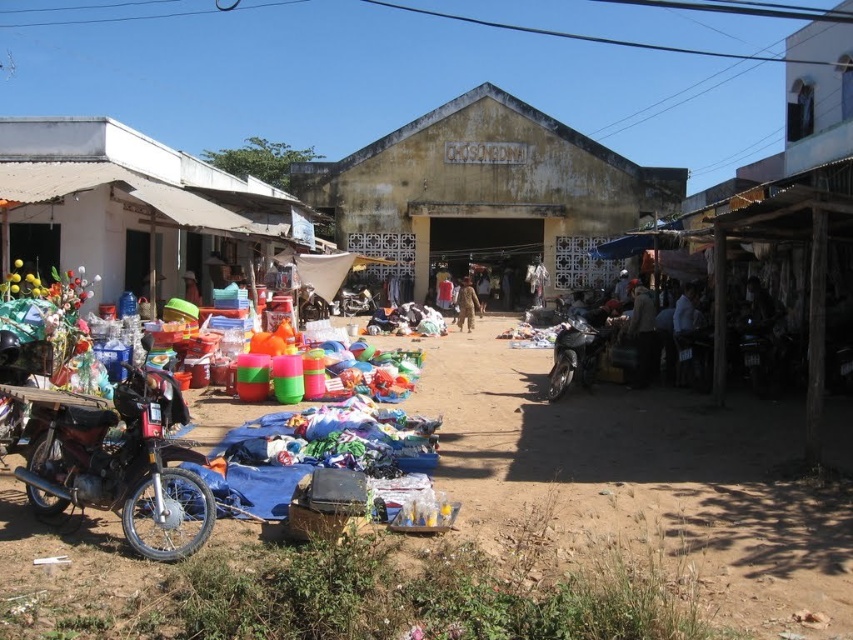
Who is shorter, brown dirt field at lower left or shiny metallic motorcycle at center?

brown dirt field at lower left is shorter.

Who is positioned more to the right, brown dirt field at lower left or shiny metallic motorcycle at center?

Positioned to the right is shiny metallic motorcycle at center.

At what (x,y) coordinates should I click in order to perform the action: click on brown dirt field at lower left. Please return your answer as a coordinate pair (x, y). This screenshot has width=853, height=640. Looking at the image, I should click on (646, 480).

Locate an element on the screen. The height and width of the screenshot is (640, 853). brown dirt field at lower left is located at coordinates (646, 480).

Which is above, yellowish concrete building at center or shiny metallic motorcycle at center?

Positioned higher is yellowish concrete building at center.

Does yellowish concrete building at center have a larger size compared to shiny metallic motorcycle at center?

Correct, yellowish concrete building at center is larger in size than shiny metallic motorcycle at center.

This screenshot has width=853, height=640. What do you see at coordinates (486, 192) in the screenshot?
I see `yellowish concrete building at center` at bounding box center [486, 192].

Find the location of `yellowish concrete building at center`. yellowish concrete building at center is located at coordinates (486, 192).

Can you confirm if brown fabric jacket at center is positioned below brown fabric person at center?

Correct, brown fabric jacket at center is located below brown fabric person at center.

Who is positioned more to the left, brown fabric jacket at center or brown fabric person at center?

→ Positioned to the left is brown fabric person at center.

Between point (640, 305) and point (474, 301), which one is positioned in front?

Point (640, 305) is more forward.

The width and height of the screenshot is (853, 640). What are the coordinates of `brown fabric jacket at center` in the screenshot? It's located at (641, 333).